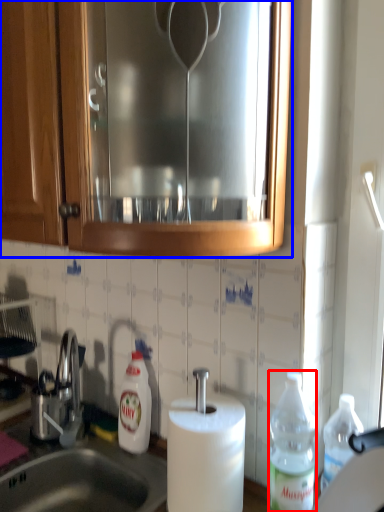
Question: Which of the following is the closest to the observer, bottle (highlighted by a red box) or cabinetry (highlighted by a blue box)?

Choices:
 (A) bottle
 (B) cabinetry

Answer: (B)